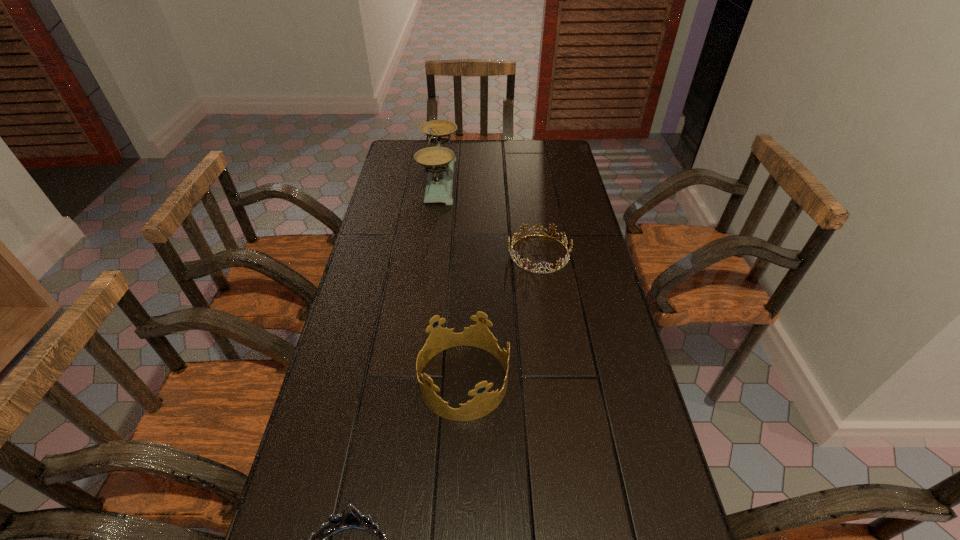
Locate an element on the screen. This screenshot has width=960, height=540. vacant space that's between the rightmost object and the tallest object is located at coordinates (490, 217).

Locate an element on the screen. vacant space that's between the third nearest object and the tallest object is located at coordinates (490, 217).

The width and height of the screenshot is (960, 540). I want to click on blank region between the farthest object and the rightmost tiara, so click(x=490, y=217).

At what (x,y) coordinates should I click in order to perform the action: click on the closest object to the tallest object. Please return your answer as a coordinate pair (x, y). The image size is (960, 540). Looking at the image, I should click on (514, 237).

Identify which object is the third closest to the farthest object. Please provide its 2D coordinates. Your answer should be formatted as a tuple, i.e. [(x, y)], where the tuple contains the x and y coordinates of a point satisfying the conditions above.

[(351, 522)]

The image size is (960, 540). What are the coordinates of `tiara that is the second closest to the second farthest tiara` in the screenshot? It's located at (514, 237).

Choose which tiara is the second nearest neighbor to the farthest object. Please provide its 2D coordinates. Your answer should be formatted as a tuple, i.e. [(x, y)], where the tuple contains the x and y coordinates of a point satisfying the conditions above.

[(478, 335)]